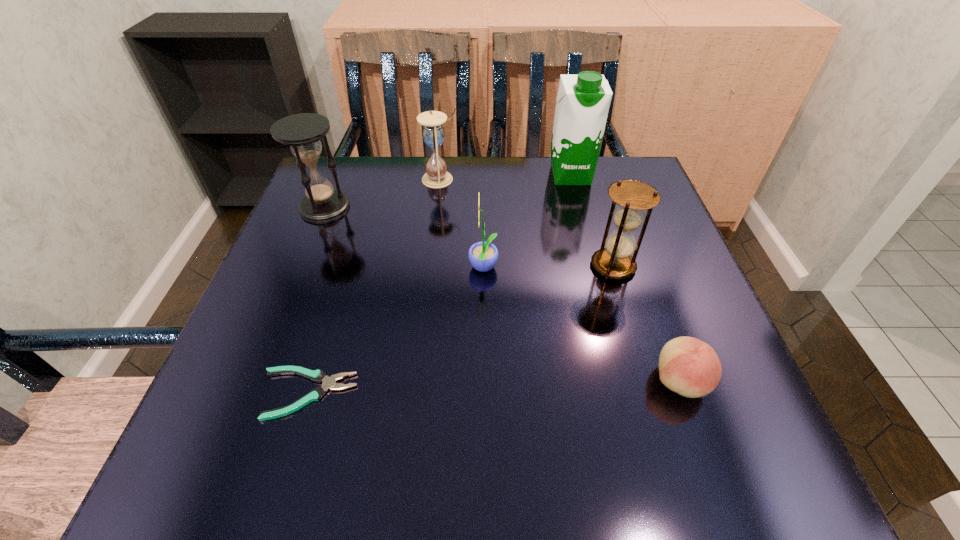
This screenshot has width=960, height=540. In order to click on vacant area that lies between the second farthest hourglass and the soya milk in this screenshot , I will do `click(447, 191)`.

Where is `free space between the fourth object from left to right and the farthest hourglass`? Image resolution: width=960 pixels, height=540 pixels. free space between the fourth object from left to right and the farthest hourglass is located at coordinates click(462, 224).

Locate an element on the screen. The image size is (960, 540). unoccupied area between the nearest hourglass and the farthest hourglass is located at coordinates (527, 222).

The width and height of the screenshot is (960, 540). In order to click on free point between the nearest hourglass and the shortest object in this screenshot , I will do `click(461, 330)`.

The image size is (960, 540). What are the coordinates of `vacant region between the shortest object and the sunflower` in the screenshot? It's located at pyautogui.click(x=396, y=331).

Where is `vacant area that lies between the second hourglass from right to left and the soya milk`? The width and height of the screenshot is (960, 540). vacant area that lies between the second hourglass from right to left and the soya milk is located at coordinates (505, 177).

Point out which object is positioned as the second nearest to the pliers. Please provide its 2D coordinates. Your answer should be formatted as a tuple, i.e. [(x, y)], where the tuple contains the x and y coordinates of a point satisfying the conditions above.

[(302, 132)]

Select which object is the second closest to the tallest object. Please provide its 2D coordinates. Your answer should be formatted as a tuple, i.e. [(x, y)], where the tuple contains the x and y coordinates of a point satisfying the conditions above.

[(433, 134)]

Identify the location of the second closest hourglass to the peach. (433, 134).

Identify which hourglass is located as the nearest to the second shortest object. Please provide its 2D coordinates. Your answer should be formatted as a tuple, i.e. [(x, y)], where the tuple contains the x and y coordinates of a point satisfying the conditions above.

[(614, 261)]